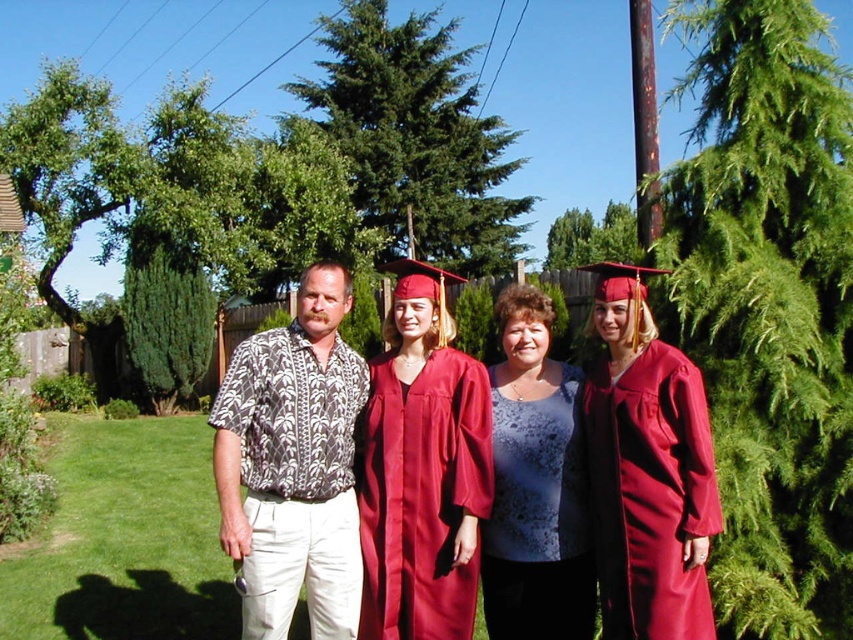
Identify the location of maroon satin gown at center. (647, 468).

Can you confirm if maroon satin gown at center is bigger than matte red graduation gown at center?

No, maroon satin gown at center is not bigger than matte red graduation gown at center.

What do you see at coordinates (647, 468) in the screenshot?
I see `maroon satin gown at center` at bounding box center [647, 468].

What are the coordinates of `maroon satin gown at center` in the screenshot? It's located at (647, 468).

Can you confirm if brown printed shirt at left is shorter than maroon satin gown at center?

Incorrect, brown printed shirt at left's height does not fall short of maroon satin gown at center's.

This screenshot has height=640, width=853. Describe the element at coordinates (293, 465) in the screenshot. I see `brown printed shirt at left` at that location.

Does point (329, 582) come behind point (648, 374)?

Yes.

What are the coordinates of `brown printed shirt at left` in the screenshot? It's located at (293, 465).

Which is behind, point (553, 397) or point (709, 458)?

The point (553, 397) is more distant.

Find the location of a particular element. This screenshot has height=640, width=853. blue satin blouse at center is located at coordinates (535, 484).

You are a GUI agent. You are given a task and a screenshot of the screen. Output one action in this format:
    pyautogui.click(x=<x>, y=<y>)
    Task: Click on the blue satin blouse at center
    Image resolution: width=853 pixels, height=640 pixels.
    Given the screenshot: What is the action you would take?
    pyautogui.click(x=535, y=484)

What are the coordinates of `blue satin blouse at center` in the screenshot? It's located at (535, 484).